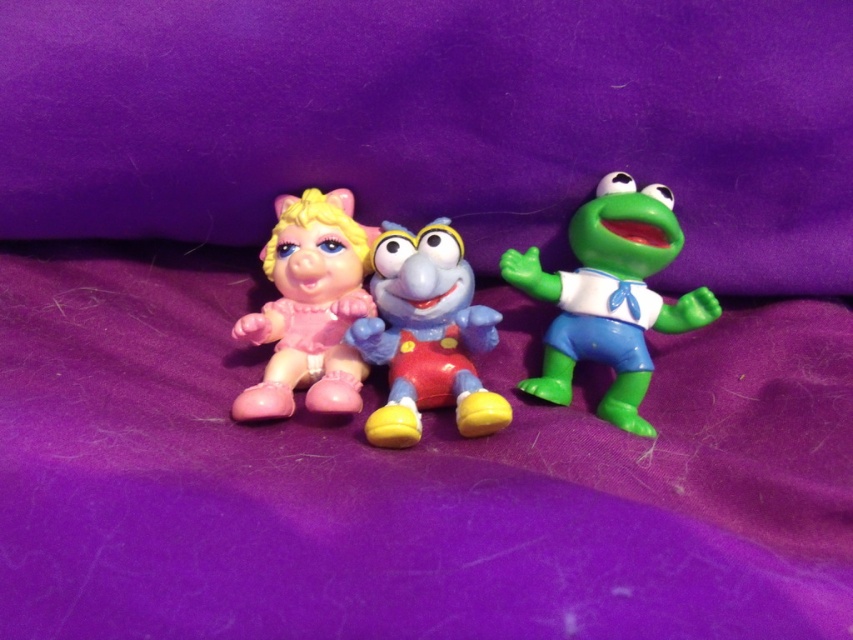
Question: Which point is farther to the camera?

Choices:
 (A) plastic blue elephant at center
 (B) matte plastic piglet at left

Answer: (B)

Question: Which of the following is the farthest from the observer?

Choices:
 (A) (648, 211)
 (B) (276, 397)

Answer: (A)

Question: Can you confirm if plastic blue elephant at center is positioned to the left of matte plastic piglet at left?

Choices:
 (A) no
 (B) yes

Answer: (A)

Question: Does plastic blue elephant at center have a larger size compared to matte plastic piglet at left?

Choices:
 (A) yes
 (B) no

Answer: (A)

Question: Does green plastic frog at right appear over plastic blue elephant at center?

Choices:
 (A) no
 (B) yes

Answer: (B)

Question: Among these points, which one is farthest from the camera?

Choices:
 (A) (621, 269)
 (B) (465, 264)

Answer: (B)